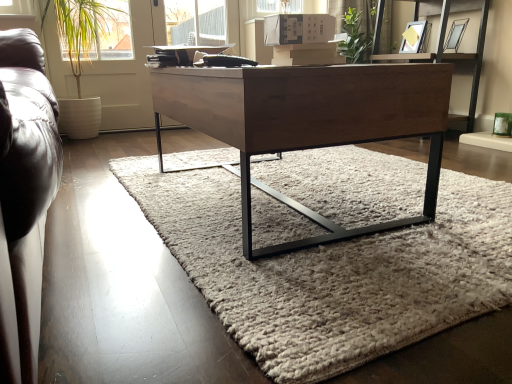
Question: From the image's perspective, would you say green leafy plant at left is positioned over wooden desk at center?

Choices:
 (A) yes
 (B) no

Answer: (A)

Question: Is green leafy plant at left closer to the viewer compared to wooden desk at center?

Choices:
 (A) no
 (B) yes

Answer: (A)

Question: Can you confirm if green leafy plant at left is smaller than wooden desk at center?

Choices:
 (A) no
 (B) yes

Answer: (B)

Question: Does green leafy plant at left have a greater width compared to wooden desk at center?

Choices:
 (A) no
 (B) yes

Answer: (A)

Question: Is green leafy plant at left positioned beyond the bounds of wooden desk at center?

Choices:
 (A) no
 (B) yes

Answer: (B)

Question: Considering the relative sizes of green leafy plant at left and wooden desk at center in the image provided, is green leafy plant at left bigger than wooden desk at center?

Choices:
 (A) yes
 (B) no

Answer: (B)

Question: Does wooden desk at center have a greater width compared to wooden shelf at upper center?

Choices:
 (A) yes
 (B) no

Answer: (A)

Question: From the image's perspective, is wooden desk at center on wooden shelf at upper center?

Choices:
 (A) yes
 (B) no

Answer: (B)

Question: Is wooden desk at center positioned with its back to wooden shelf at upper center?

Choices:
 (A) yes
 (B) no

Answer: (B)

Question: Is the depth of wooden desk at center greater than that of wooden shelf at upper center?

Choices:
 (A) yes
 (B) no

Answer: (B)

Question: Are wooden desk at center and wooden shelf at upper center beside each other?

Choices:
 (A) no
 (B) yes

Answer: (A)

Question: From a real-world perspective, is wooden desk at center beneath wooden shelf at upper center?

Choices:
 (A) yes
 (B) no

Answer: (A)

Question: Is soft gray wool rug at center wider than wooden desk at center?

Choices:
 (A) yes
 (B) no

Answer: (A)